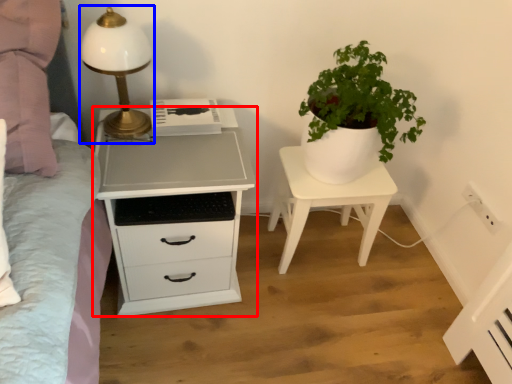
Question: Which point is closer to the camera, chest of drawers (highlighted by a red box) or table lamp (highlighted by a blue box)?

Choices:
 (A) chest of drawers
 (B) table lamp

Answer: (B)